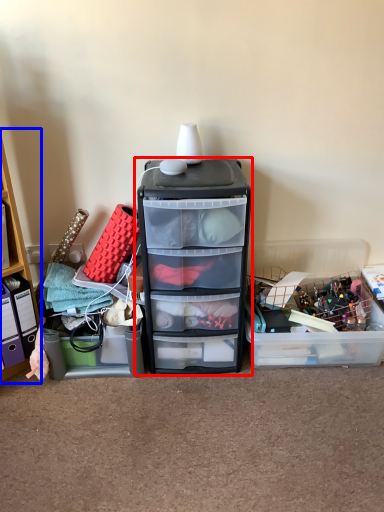
Question: Which object appears closest to the camera in this image, filing cabinet (highlighted by a red box) or cabinetry (highlighted by a blue box)?

Choices:
 (A) filing cabinet
 (B) cabinetry

Answer: (B)